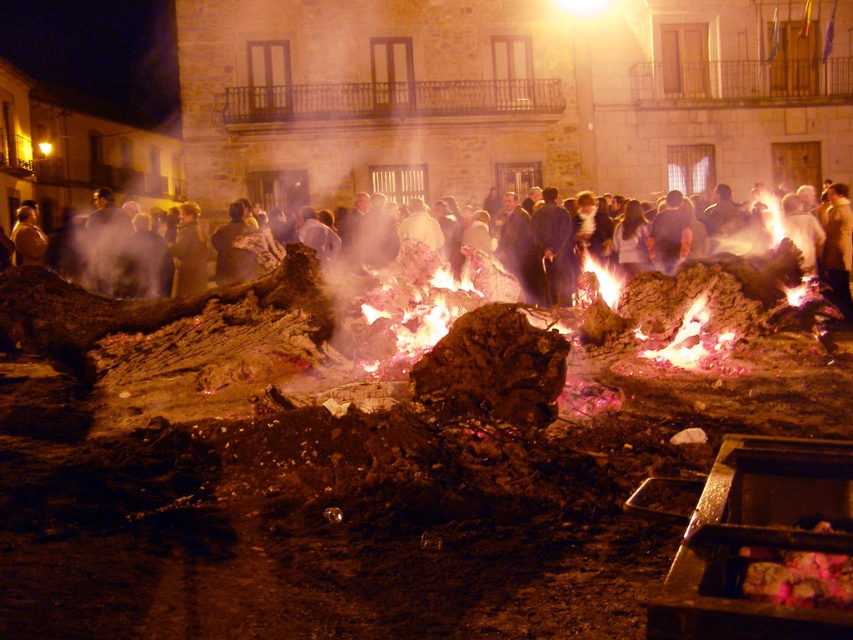
Question: Is white cotton dress at center above charred wood at center?

Choices:
 (A) yes
 (B) no

Answer: (A)

Question: Which of the following is the closest to the observer?

Choices:
 (A) charred wood at center
 (B) charcoal ash fire pit at lower right

Answer: (B)

Question: Estimate the real-world distances between objects in this image. Which object is farther from the charcoal ash fire pit at lower right?

Choices:
 (A) charred wood at center
 (B) white cotton dress at center

Answer: (B)

Question: Considering the real-world distances, which object is closest to the charred wood at center?

Choices:
 (A) charcoal ash fire pit at lower right
 (B) white cotton dress at center

Answer: (A)

Question: Does charcoal ash fire pit at lower right appear on the right side of white cotton dress at center?

Choices:
 (A) yes
 (B) no

Answer: (B)

Question: Is white cotton dress at center wider than charred wood at center?

Choices:
 (A) no
 (B) yes

Answer: (A)